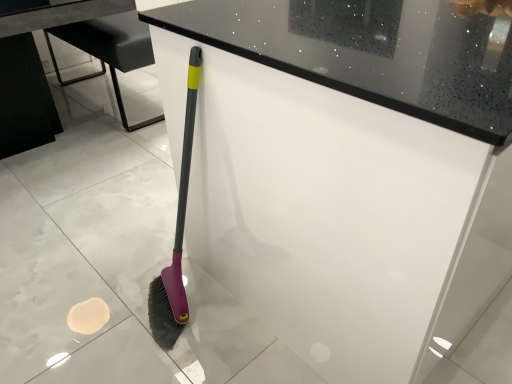
Question: Would you say black glossy table at lower left is to the left or to the right of white glossy counter at center in the picture?

Choices:
 (A) left
 (B) right

Answer: (A)

Question: In terms of size, does black glossy table at lower left appear bigger or smaller than white glossy counter at center?

Choices:
 (A) big
 (B) small

Answer: (B)

Question: Based on their relative distances, which object is farther from the white glossy counter at center?

Choices:
 (A) black glossy table at lower left
 (B) metallic gray table at center

Answer: (A)

Question: Which of these objects is positioned farthest from the black glossy table at lower left?

Choices:
 (A) white glossy counter at center
 (B) metallic gray table at center

Answer: (A)